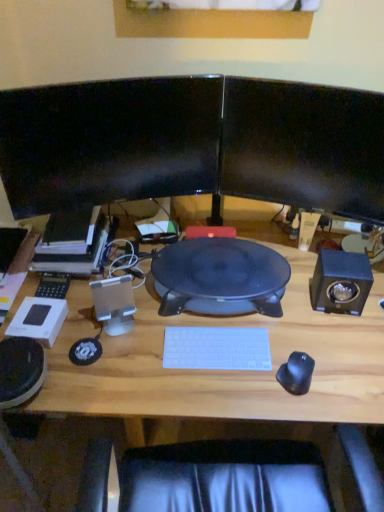
Where is `free space above white plastic keyboard at center (from a real-world perspective)`? This screenshot has height=512, width=384. free space above white plastic keyboard at center (from a real-world perspective) is located at coordinates (215, 346).